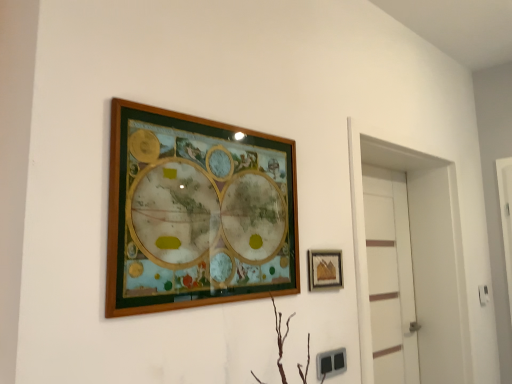
Question: Considering the relative sizes of wooden picture frame at upper center, placed as the second picture frame when sorted from back to front, and white matte door at right in the image provided, is wooden picture frame at upper center, placed as the second picture frame when sorted from back to front, thinner than white matte door at right?

Choices:
 (A) yes
 (B) no

Answer: (A)

Question: From a real-world perspective, is wooden picture frame at upper center, the 1th picture frame when ordered from front to back, physically below white matte door at right?

Choices:
 (A) yes
 (B) no

Answer: (B)

Question: Is wooden picture frame at upper center, placed as the second picture frame when sorted from back to front, completely or partially outside of white matte door at right?

Choices:
 (A) yes
 (B) no

Answer: (A)

Question: Can you confirm if wooden picture frame at upper center, arranged as the 1th picture frame when viewed from the left, is shorter than white matte door at right?

Choices:
 (A) no
 (B) yes

Answer: (B)

Question: Does point (399, 173) appear closer or farther from the camera than point (318, 269)?

Choices:
 (A) farther
 (B) closer

Answer: (A)

Question: Is white matte door at right in front of or behind matte gold picture frame at right, arranged as the 2th picture frame when viewed from the left, in the image?

Choices:
 (A) front
 (B) behind

Answer: (B)

Question: Considering the positions of white matte door at right and matte gold picture frame at right, arranged as the 1th picture frame when viewed from the back, in the image, is white matte door at right bigger or smaller than matte gold picture frame at right, arranged as the 1th picture frame when viewed from the back,?

Choices:
 (A) big
 (B) small

Answer: (A)

Question: Do you think white matte door at right is within matte gold picture frame at right, arranged as the first picture frame when viewed from the right, or outside of it?

Choices:
 (A) outside
 (B) inside

Answer: (A)

Question: Looking at their shapes, would you say white glossy door at right is wider or thinner than white matte door at right?

Choices:
 (A) thin
 (B) wide

Answer: (B)

Question: Which is correct: white glossy door at right is inside white matte door at right, or outside of it?

Choices:
 (A) inside
 (B) outside

Answer: (B)

Question: Based on their sizes in the image, would you say white glossy door at right is bigger or smaller than white matte door at right?

Choices:
 (A) big
 (B) small

Answer: (A)

Question: Relative to white matte door at right, is white glossy door at right in front or behind?

Choices:
 (A) behind
 (B) front

Answer: (B)

Question: Is white glossy door at right taller or shorter than matte gold picture frame at right, arranged as the 2th picture frame when viewed from the left?

Choices:
 (A) short
 (B) tall

Answer: (B)

Question: From a real-world perspective, relative to matte gold picture frame at right, which is the 2th picture frame from front to back, is white glossy door at right vertically above or below?

Choices:
 (A) above
 (B) below

Answer: (B)